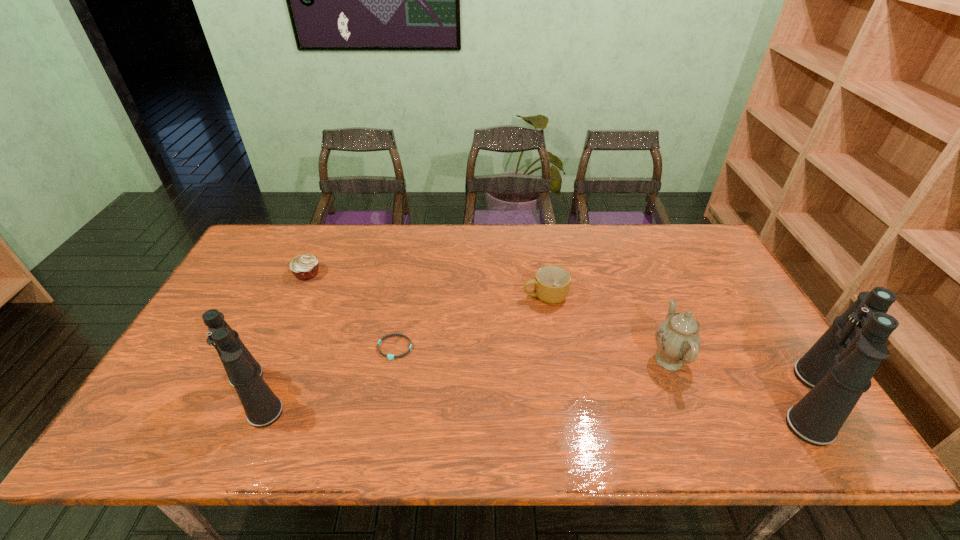
In the image, there is a desktop. Identify the location of vacant space at the right edge. point(751,368).

Locate an element on the screen. vacant space at the far left corner is located at coordinates (266, 235).

Locate an element on the screen. free point between the taller binoculars and the left binoculars is located at coordinates (534, 397).

Identify the location of free space between the right binoculars and the left binoculars. The image size is (960, 540). (534, 397).

The height and width of the screenshot is (540, 960). I want to click on vacant area between the rightmost object and the second tallest object, so click(x=534, y=397).

You are a GUI agent. You are given a task and a screenshot of the screen. Output one action in this format:
    pyautogui.click(x=<x>, y=<y>)
    Task: Click on the free space between the left binoculars and the fourth object from left to right
    
    Given the screenshot: What is the action you would take?
    pyautogui.click(x=400, y=345)

Find the location of a particular element. free space between the tallest object and the chinaware is located at coordinates (740, 380).

You are a GUI agent. You are given a task and a screenshot of the screen. Output one action in this format:
    pyautogui.click(x=<x>, y=<y>)
    Task: Click on the vacant region between the chinaware and the fourth object from left to right
    The image size is (960, 540).
    Given the screenshot: What is the action you would take?
    pyautogui.click(x=607, y=328)

This screenshot has width=960, height=540. I want to click on unoccupied position between the muffin and the right binoculars, so click(x=560, y=337).

In order to click on free point between the shortest object and the muffin in this screenshot , I will do click(351, 310).